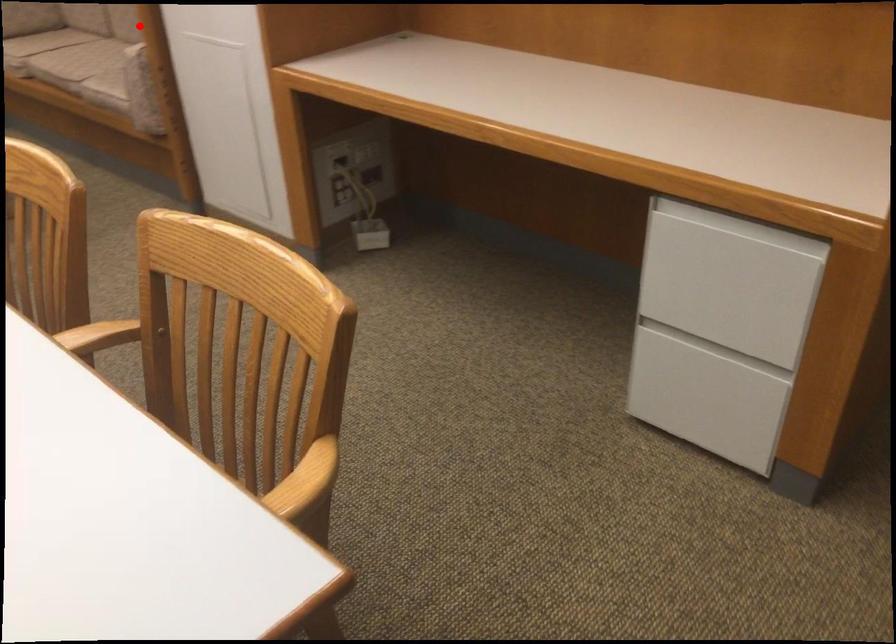
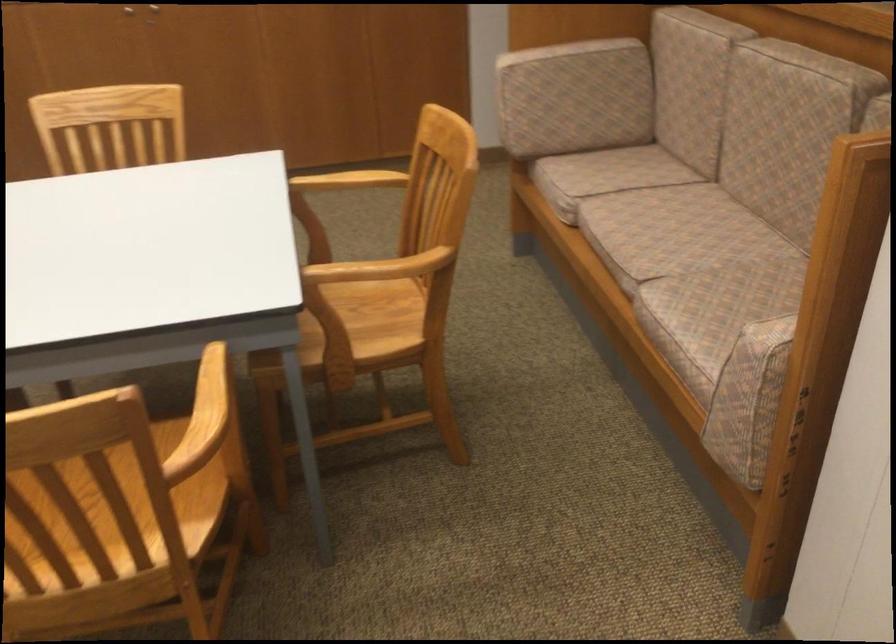
Question: I am providing you with two images of the same scene from different viewpoints. A red point is marked on the first image. At the location where the point appears in image 1, is it still visible in image 2?

Choices:
 (A) Yes
 (B) No

Answer: (B)